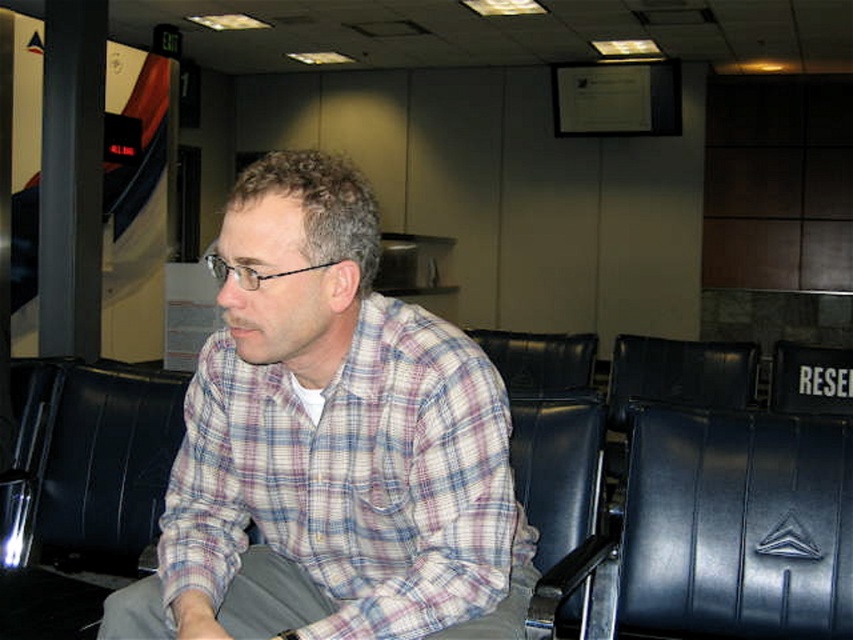
You are a photographer standing in the waiting area. You want to take a photo of the plaid cotton shirt at center. Your camera is 36.59 inches away from the shirt. Is the camera within the minimum focusing distance required to capture a clear image?

The plaid cotton shirt at center and camera are 36.59 inches apart from each other. If the camera requires a closer distance for clear focus, then it may not be sufficient. However, standard cameras can focus at this distance, so it should be okay.

You are a photographer trying to capture the man in the plaid cotton shirt at center and the black leather armchair at left. Which object will appear larger in your photo?

The plaid cotton shirt at center will appear larger in the photo because it is closer to the viewer than the black leather armchair at left.

You are in a waiting area and need to sit down. You see a black leather swivel chair at center and a black leather armchair at left. Which one is closer to the entrance if the entrance is to your right?

The black leather swivel chair at center is to the right of the black leather armchair at left, so if the entrance is to your right, the black leather swivel chair at center would be closer to the entrance.